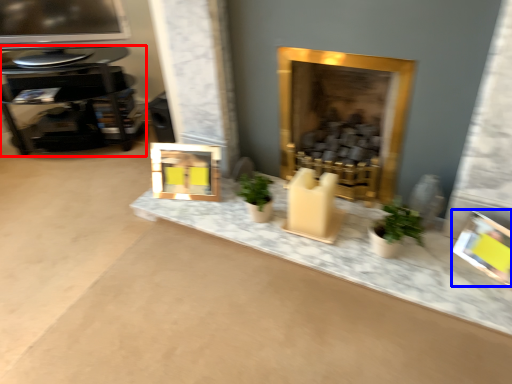
Question: Among these objects, which one is nearest to the camera, table (highlighted by a red box) or picture frame (highlighted by a blue box)?

Choices:
 (A) table
 (B) picture frame

Answer: (B)